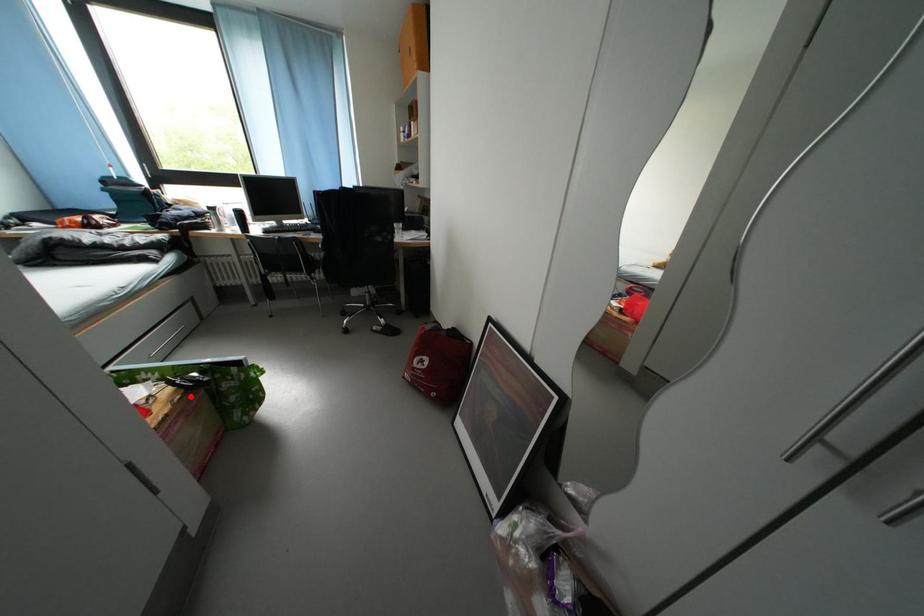
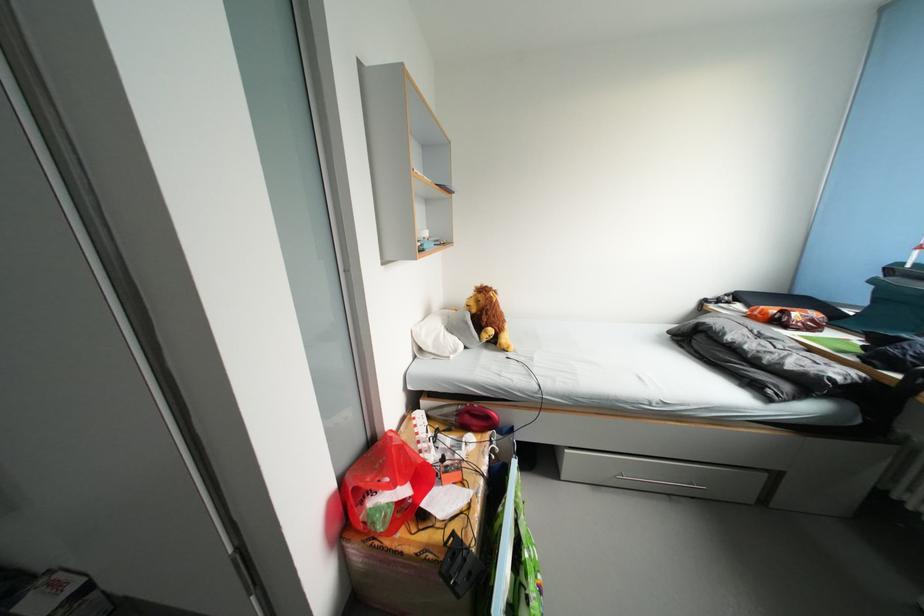
The point at the highlighted location is marked in the first image. Where is the corresponding point in the second image?

(450, 562)